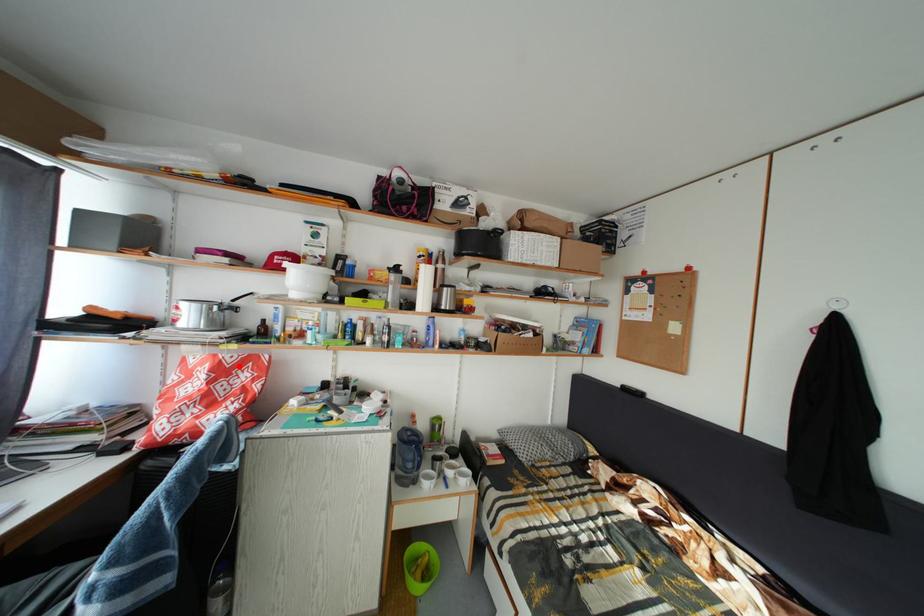
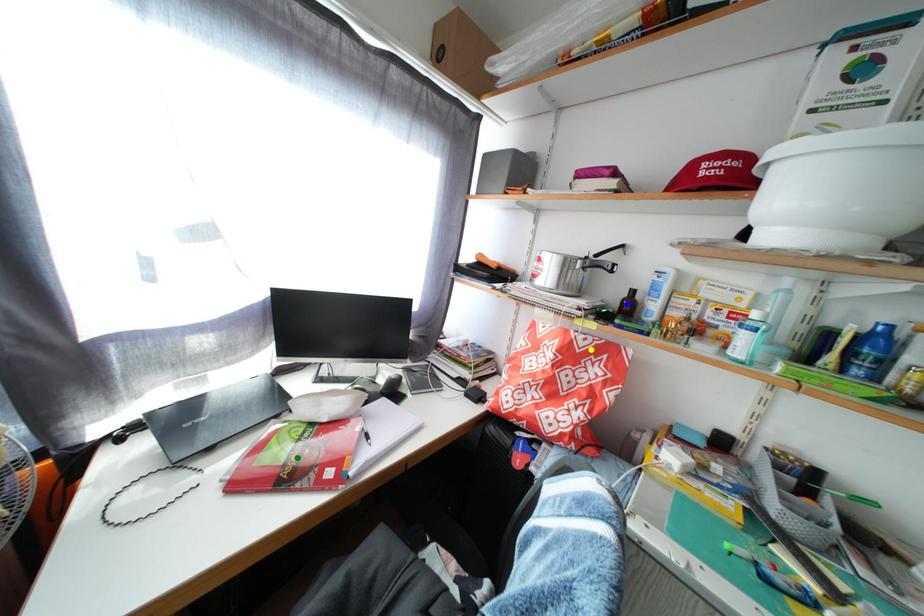
Question: I am providing you with two images of the same scene from different viewpoints. A red point is marked on the first image. You are given multiple points on the second image. In image 2, which mark is for the same physical point as the one in image 1?

Choices:
 (A) green point
 (B) yellow point
 (C) blue point

Answer: (B)